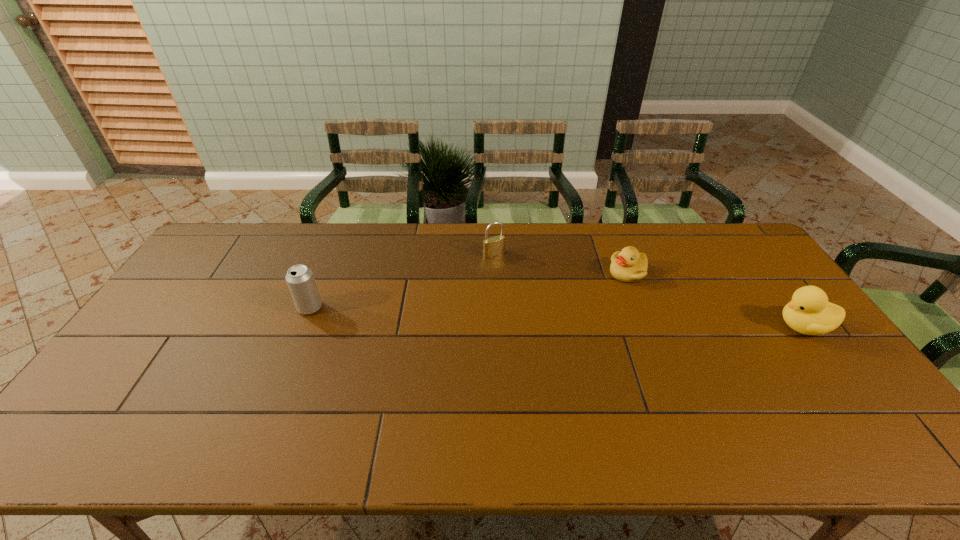
This screenshot has width=960, height=540. In order to click on vacant point that satisfies the following two spatial constraints: 1. on the front side of the duck; 2. on the front-facing side of the duckling in this screenshot , I will do `click(649, 327)`.